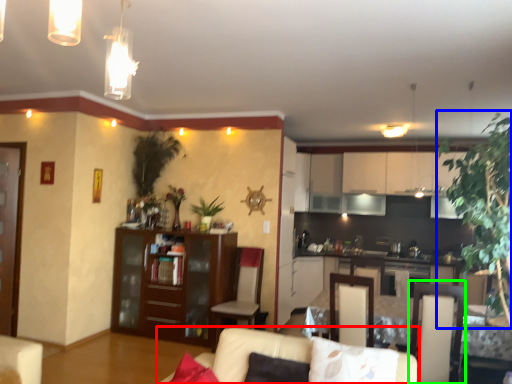
Question: Considering the real-world distances, which object is farthest from studio couch (highlighted by a red box)? plant (highlighted by a blue box) or armchair (highlighted by a green box)?

Choices:
 (A) plant
 (B) armchair

Answer: (A)